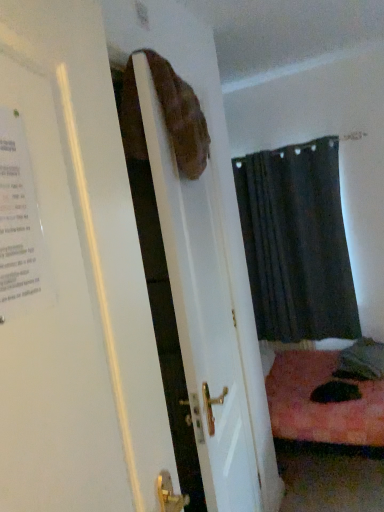
Question: Is white paper poster at left located outside matte brown bag at upper center?

Choices:
 (A) yes
 (B) no

Answer: (B)

Question: Considering the relative sizes of white paper poster at left and matte brown bag at upper center in the image provided, is white paper poster at left thinner than matte brown bag at upper center?

Choices:
 (A) no
 (B) yes

Answer: (B)

Question: Considering the relative positions of white paper poster at left and matte brown bag at upper center in the image provided, is white paper poster at left to the right of matte brown bag at upper center from the viewer's perspective?

Choices:
 (A) yes
 (B) no

Answer: (B)

Question: From the image's perspective, is white paper poster at left located beneath matte brown bag at upper center?

Choices:
 (A) yes
 (B) no

Answer: (B)

Question: Can you confirm if white paper poster at left is bigger than matte brown bag at upper center?

Choices:
 (A) yes
 (B) no

Answer: (B)

Question: Considering the relative sizes of white paper poster at left and matte brown bag at upper center in the image provided, is white paper poster at left wider than matte brown bag at upper center?

Choices:
 (A) yes
 (B) no

Answer: (B)

Question: Can you confirm if dark fabric curtain at center is wider than matte brown bag at upper center?

Choices:
 (A) no
 (B) yes

Answer: (B)

Question: From the image's perspective, does dark fabric curtain at center appear higher than matte brown bag at upper center?

Choices:
 (A) yes
 (B) no

Answer: (A)

Question: Can you confirm if dark fabric curtain at center is smaller than matte brown bag at upper center?

Choices:
 (A) no
 (B) yes

Answer: (A)

Question: Is dark fabric curtain at center far away from matte brown bag at upper center?

Choices:
 (A) no
 (B) yes

Answer: (B)

Question: Is dark fabric curtain at center positioned with its back to matte brown bag at upper center?

Choices:
 (A) yes
 (B) no

Answer: (B)

Question: Does dark fabric curtain at center have a lesser width compared to matte brown bag at upper center?

Choices:
 (A) yes
 (B) no

Answer: (B)

Question: Is matte brown bag at upper center positioned behind dark fabric curtain at center?

Choices:
 (A) no
 (B) yes

Answer: (A)